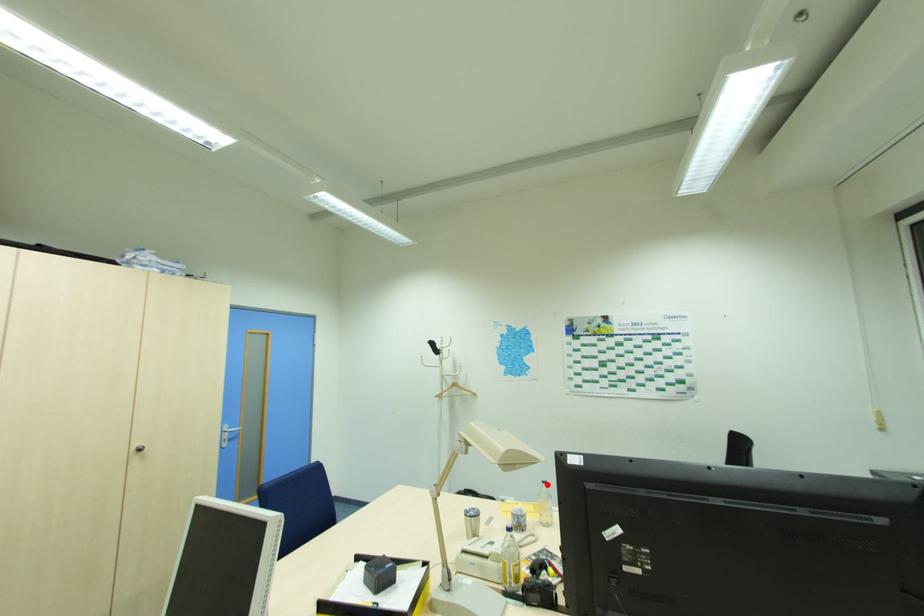
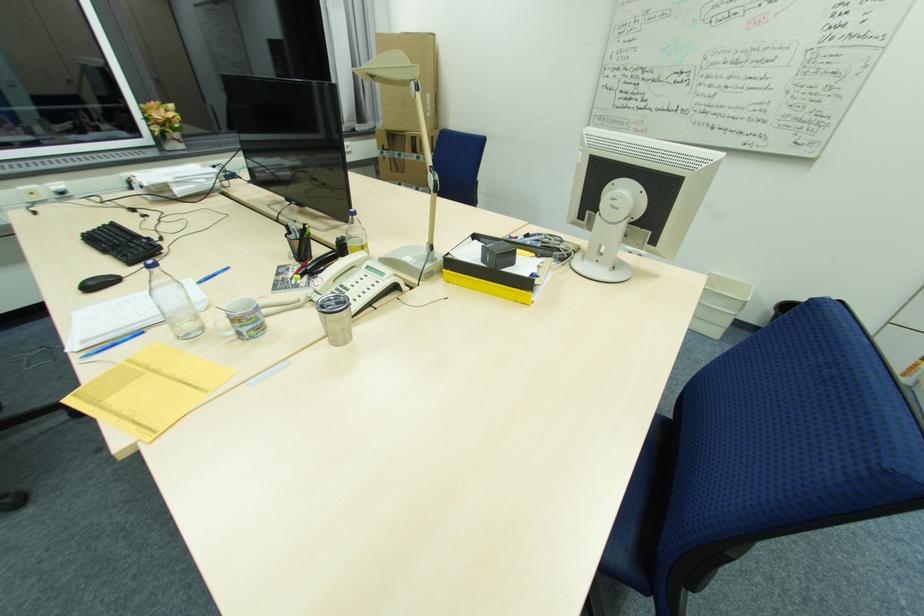
Locate, in the second image, the point that corresponds to the highlighted location in the first image.

(157, 270)